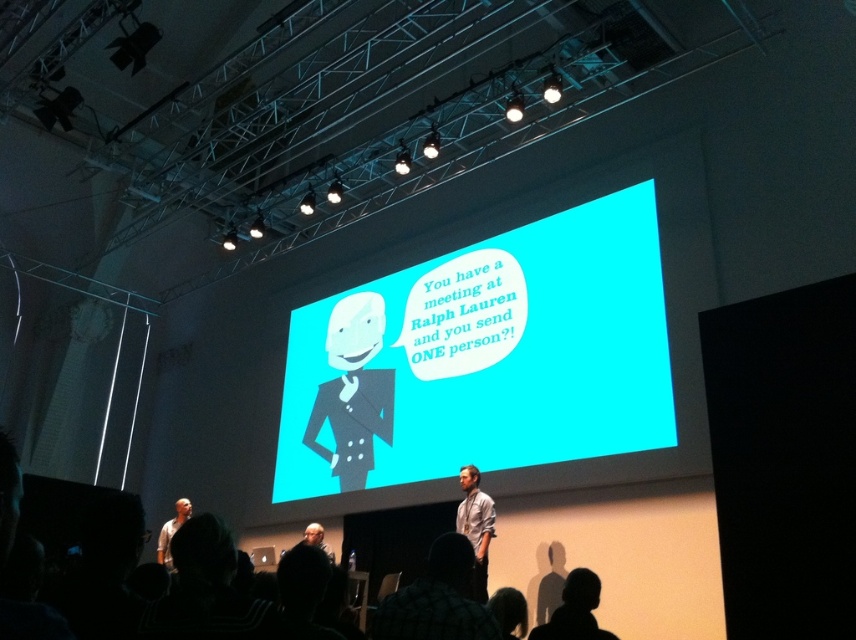
Question: Which object is positioned farthest from the matte blue screen at center?

Choices:
 (A) light blue shirt at center
 (B) white matte shirt at lower left

Answer: (B)

Question: Is matte black suit at center further to the viewer compared to white matte shirt at lower left?

Choices:
 (A) yes
 (B) no

Answer: (A)

Question: Is light blue shirt at center to the left of white matte shirt at lower left from the viewer's perspective?

Choices:
 (A) no
 (B) yes

Answer: (A)

Question: Which of the following is the closest to the observer?

Choices:
 (A) matte black suit at center
 (B) white matte shirt at lower left

Answer: (B)

Question: Is the position of matte black suit at center less distant than that of white matte shirt at lower left?

Choices:
 (A) yes
 (B) no

Answer: (B)

Question: Which point appears closest to the camera in this image?

Choices:
 (A) (646, 365)
 (B) (456, 516)

Answer: (B)